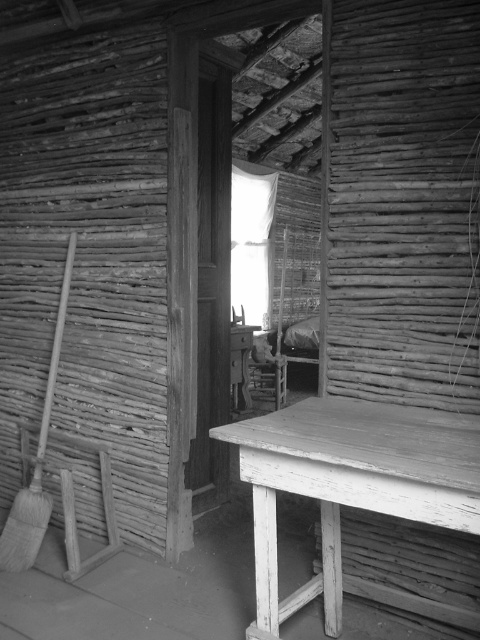
Question: Can you confirm if transparent glass window at center is positioned below wooden broom at left?

Choices:
 (A) yes
 (B) no

Answer: (B)

Question: Estimate the real-world distances between objects in this image. Which object is closer to the smooth white wooden table at center?

Choices:
 (A) transparent glass window at center
 (B) wooden broom at left

Answer: (B)

Question: Is transparent glass window at center in front of wooden broom at left?

Choices:
 (A) yes
 (B) no

Answer: (B)

Question: Is smooth white wooden table at center above transparent glass window at center?

Choices:
 (A) no
 (B) yes

Answer: (A)

Question: Which point is farther to the camera?

Choices:
 (A) (252, 316)
 (B) (12, 557)
 (C) (435, 468)

Answer: (A)

Question: Based on their relative distances, which object is farther from the smooth white wooden table at center?

Choices:
 (A) wooden broom at left
 (B) transparent glass window at center

Answer: (B)